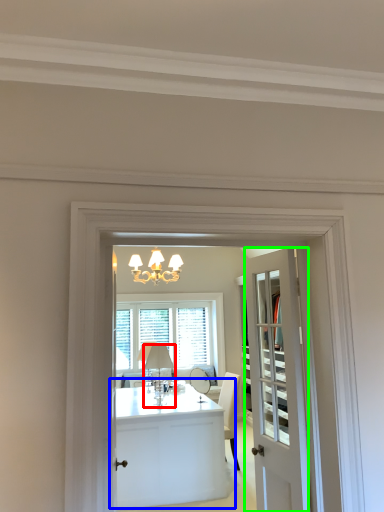
Question: Based on their relative distances, which object is farther from lamp (highlighted by a red box)? Choose from table (highlighted by a blue box) and door (highlighted by a green box).

Choices:
 (A) table
 (B) door

Answer: (B)